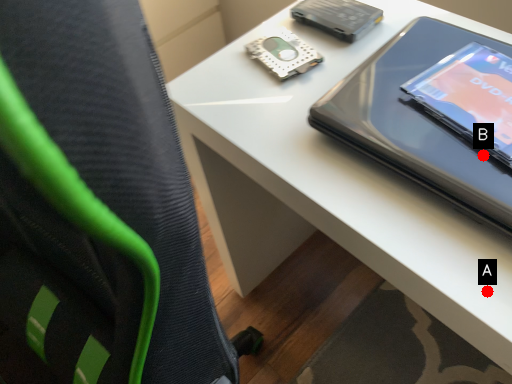
Question: Two points are circled on the image, labeled by A and B beside each circle. Which of the following is the closest to the observer?

Choices:
 (A) A is closer
 (B) B is closer

Answer: (A)